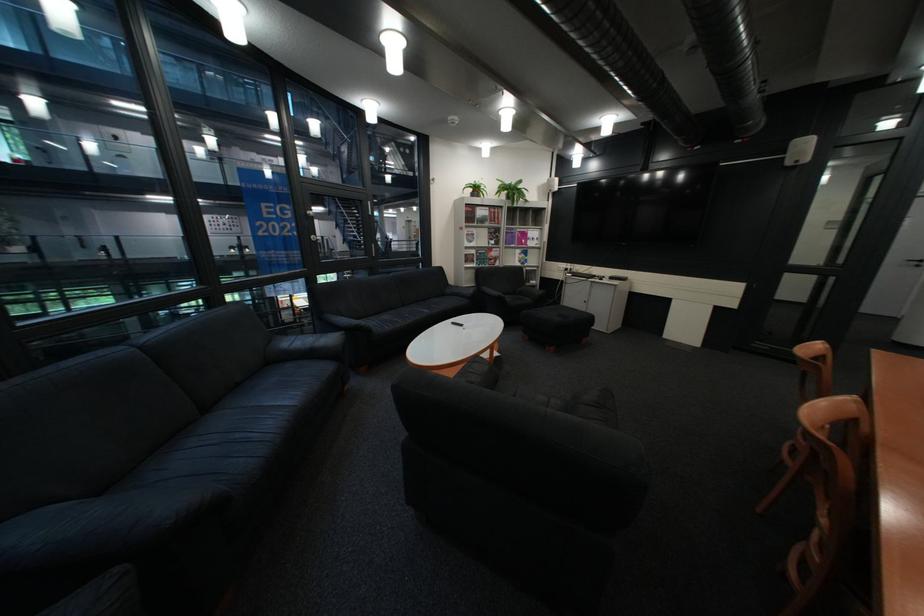
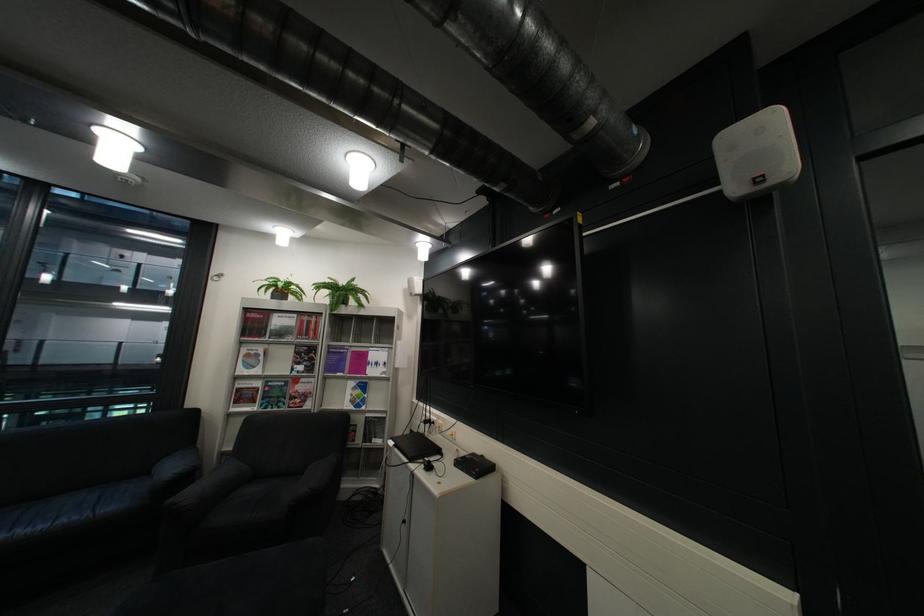
In the second image, find the point that corresponds to [548,282] in the first image.

(393, 442)